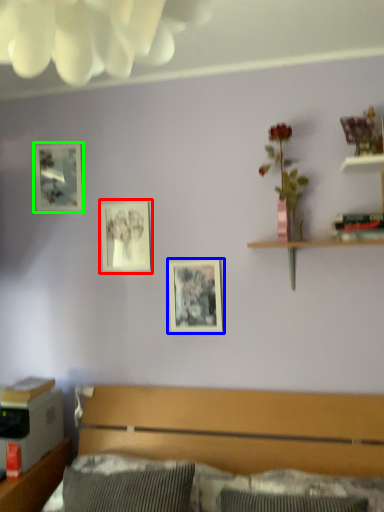
Question: Which object is positioned farthest from picture frame (highlighted by a red box)? Select from picture frame (highlighted by a blue box) and picture frame (highlighted by a green box).

Choices:
 (A) picture frame
 (B) picture frame

Answer: (B)